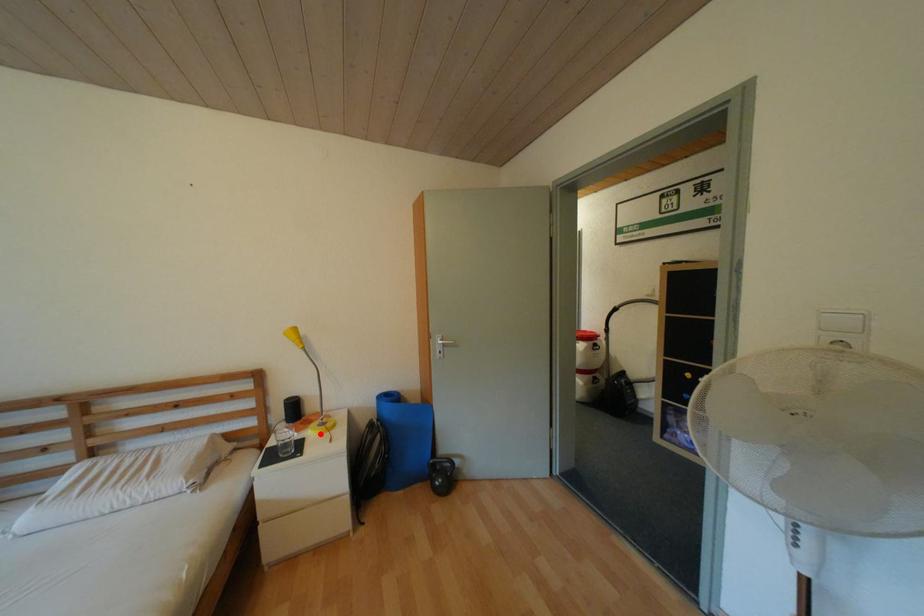
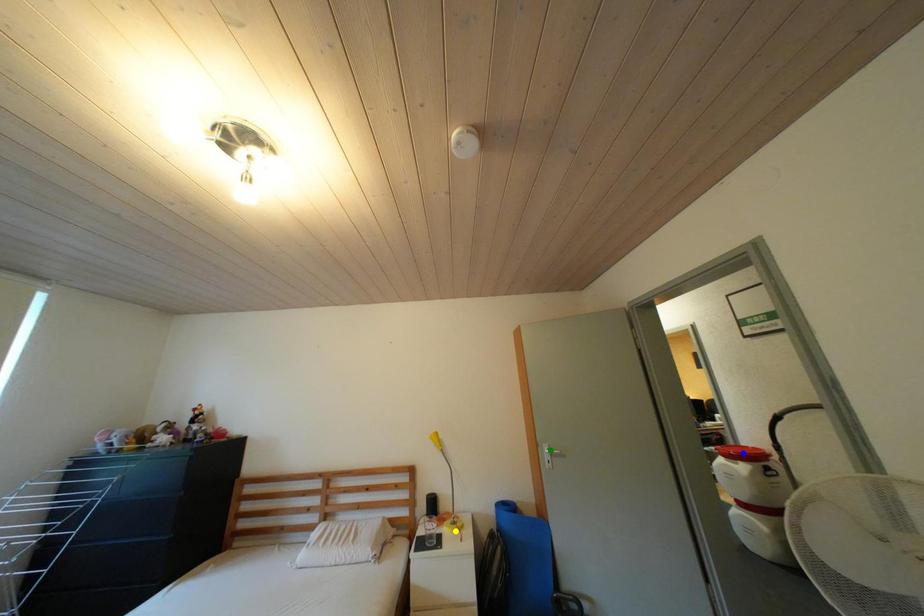
Question: I am providing you with two images of the same scene from different viewpoints. A red point is marked on the first image. You are given multiple points on the second image. Which spot in image 2 lines up with the point in image 1?

Choices:
 (A) yellow point
 (B) green point
 (C) blue point

Answer: (A)